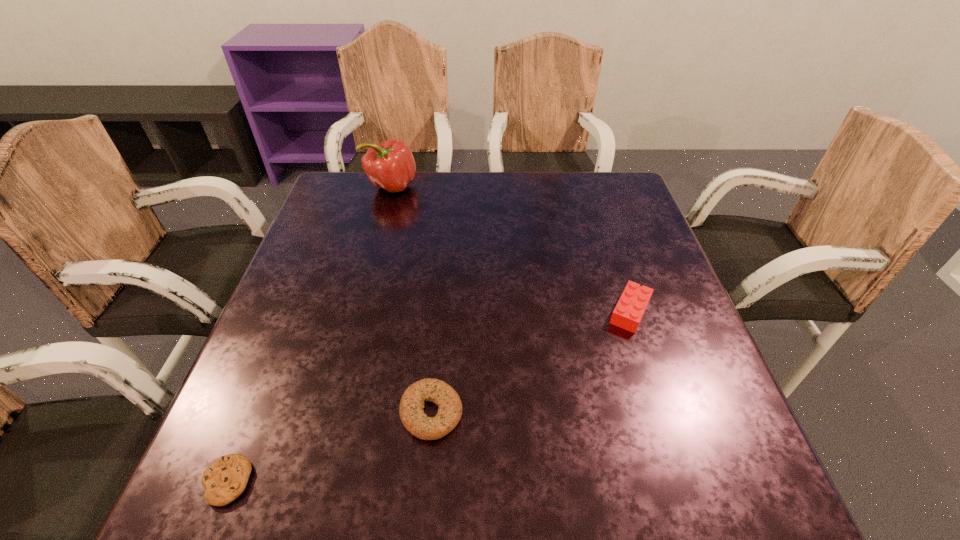
Identify the location of vacant area that lies between the bagel and the tallest object. The width and height of the screenshot is (960, 540). (412, 299).

The width and height of the screenshot is (960, 540). Identify the location of empty location between the second object from right to left and the pepper. (412, 299).

At what (x,y) coordinates should I click in order to perform the action: click on the closest object to the rightmost object. Please return your answer as a coordinate pair (x, y). Looking at the image, I should click on (412, 415).

You are a GUI agent. You are given a task and a screenshot of the screen. Output one action in this format:
    pyautogui.click(x=<x>, y=<y>)
    Task: Click on the closest object to the leftmost object
    
    Given the screenshot: What is the action you would take?
    pyautogui.click(x=412, y=415)

You are a GUI agent. You are given a task and a screenshot of the screen. Output one action in this format:
    pyautogui.click(x=<x>, y=<y>)
    Task: Click on the vacant point that satisfies the following two spatial constraints: 1. on the back side of the shortest object; 2. on the right side of the rightmost object
    
    Given the screenshot: What is the action you would take?
    click(295, 312)

I want to click on free space in the image that satisfies the following two spatial constraints: 1. on the front side of the rightmost object; 2. on the right side of the tallest object, so click(358, 312).

Image resolution: width=960 pixels, height=540 pixels. I want to click on vacant space that satisfies the following two spatial constraints: 1. on the front side of the tallest object; 2. on the right side of the bagel, so click(x=331, y=413).